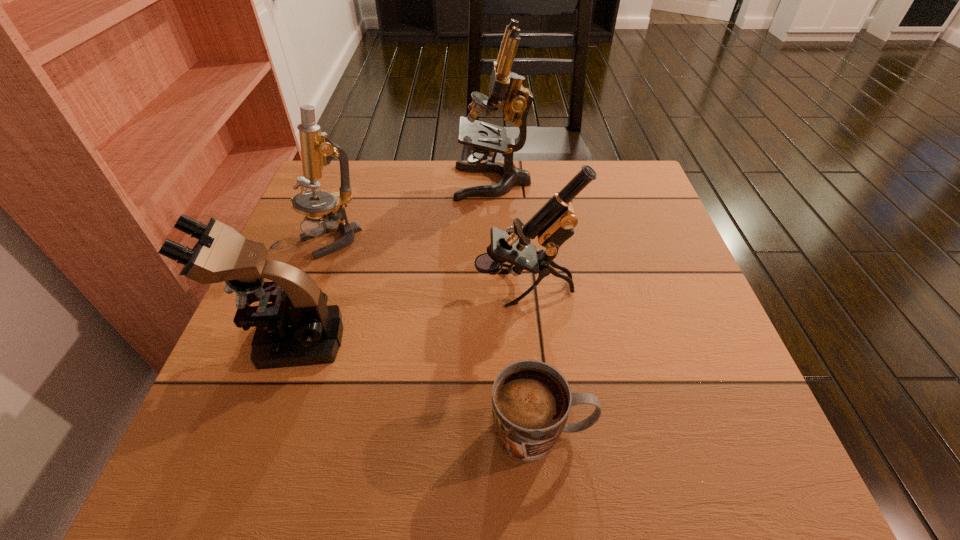
This screenshot has height=540, width=960. I want to click on the farthest microscope, so click(506, 91).

The height and width of the screenshot is (540, 960). Find the location of `the tallest object`. the tallest object is located at coordinates (506, 91).

The height and width of the screenshot is (540, 960). I want to click on the fourth nearest object, so click(x=317, y=150).

Locate an element on the screen. The width and height of the screenshot is (960, 540). the third nearest object is located at coordinates (553, 224).

At what (x,y) coordinates should I click in order to perform the action: click on the fourth farthest object. Please return your answer as a coordinate pair (x, y). Looking at the image, I should click on (298, 328).

The width and height of the screenshot is (960, 540). I want to click on mug, so click(531, 400).

At what (x,y) coordinates should I click in order to perform the action: click on the nearest object. Please return your answer as a coordinate pair (x, y). The image size is (960, 540). Looking at the image, I should click on (531, 400).

Locate an element on the screen. The width and height of the screenshot is (960, 540). free space located at the eyepieces of the farthest microscope is located at coordinates (379, 183).

Identify the location of vacant space situated 0.090m at the eyepieces of the farthest microscope. (422, 183).

Identify the location of vacant space located 0.080m at the eyepieces of the farthest microscope. (425, 183).